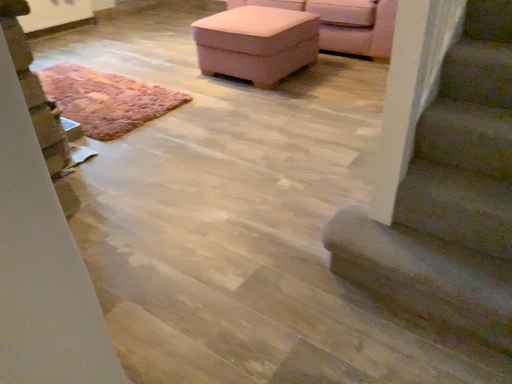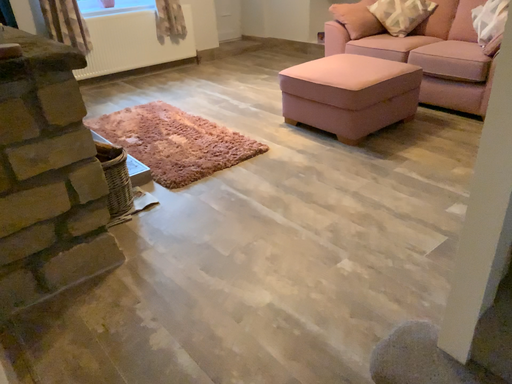
Question: Which way did the camera rotate in the video?

Choices:
 (A) rotated right
 (B) rotated left

Answer: (B)